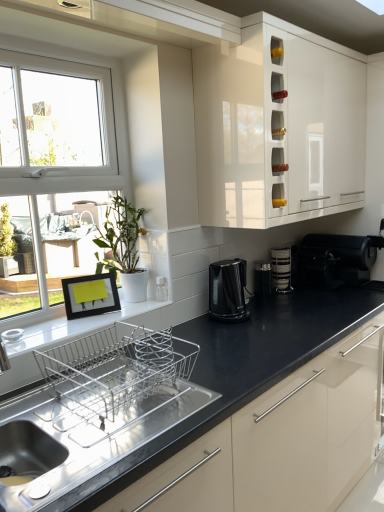
This screenshot has height=512, width=384. Find the location of `free space above white glossy window sill at lower left (from a real-world perspective)`. free space above white glossy window sill at lower left (from a real-world perspective) is located at coordinates (82, 321).